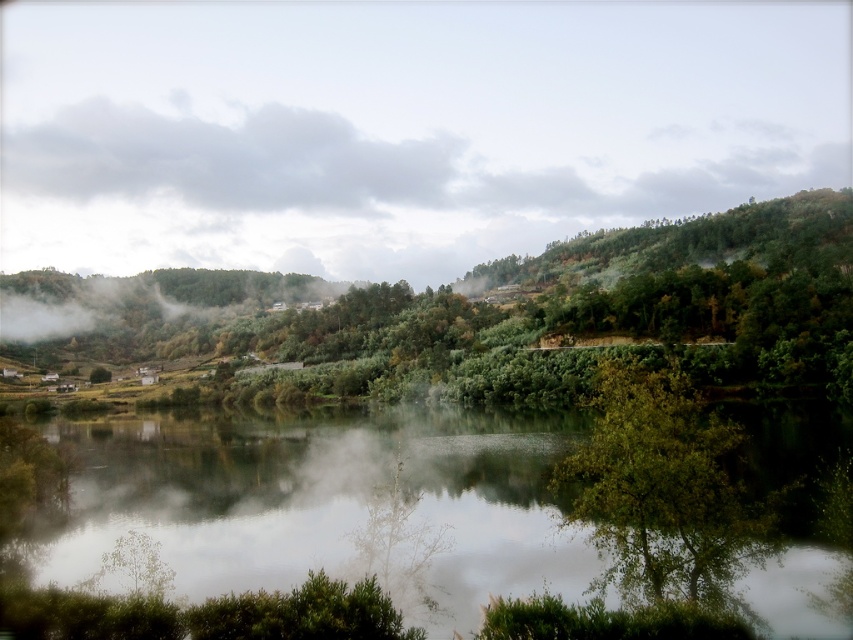
You are an observer standing at the edge of the water in the scene. You notice the white misty fog at center and the green leafy tree at lower right. Which object is directly above the other?

The white misty fog at center is positioned over the green leafy tree at lower right, meaning it is directly above it.

You are standing at the edge of the water in the serene landscape. You notice a point marked at coordinates [398,129]. What is located at this point?

The point at coordinates [398,129] corresponds to white misty fog at center.